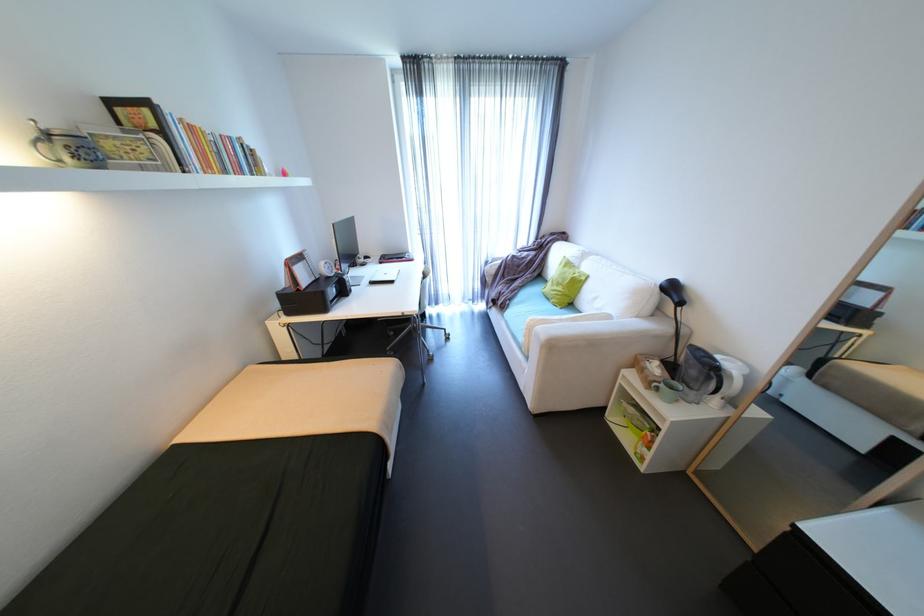
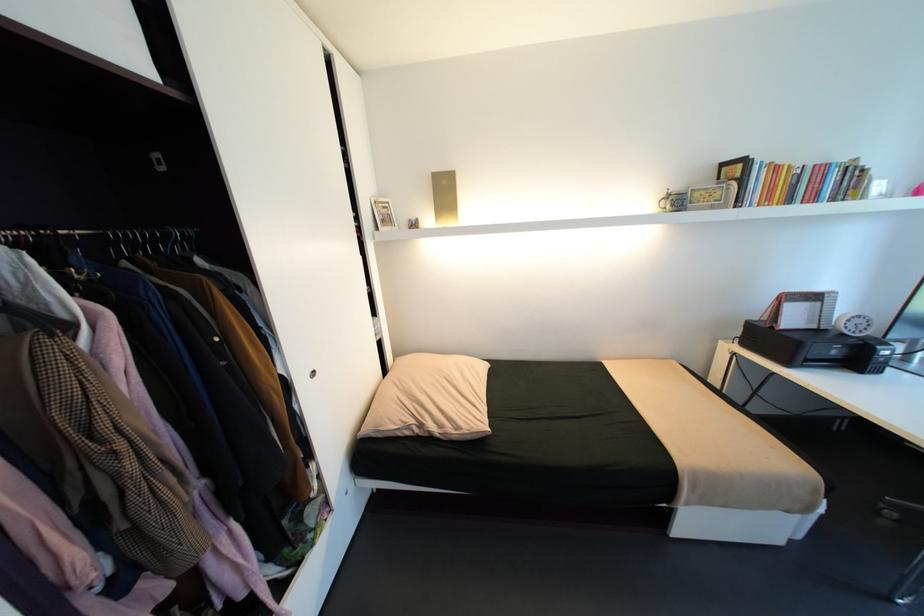
Find the pixel in the second image that matches pixel 334 278 in the first image.

(850, 334)